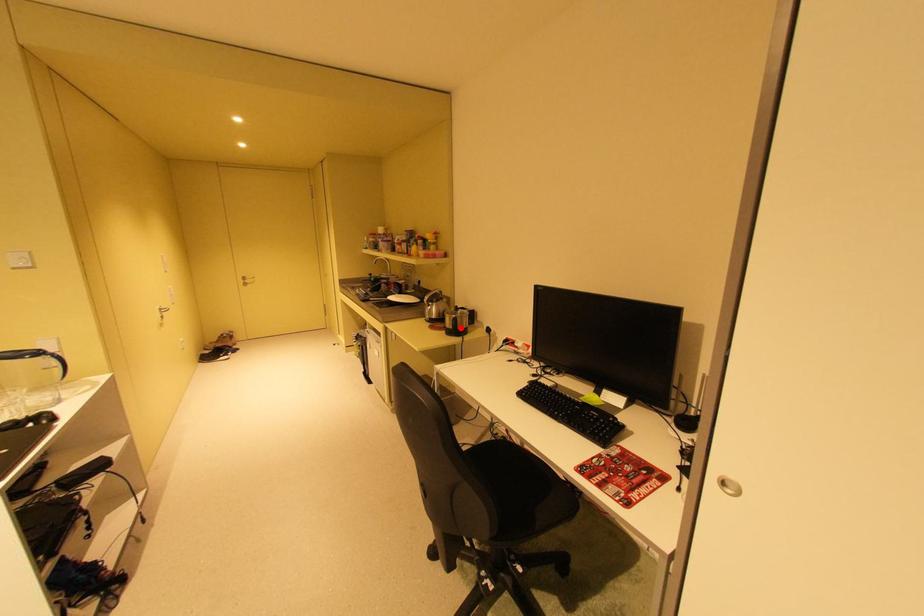
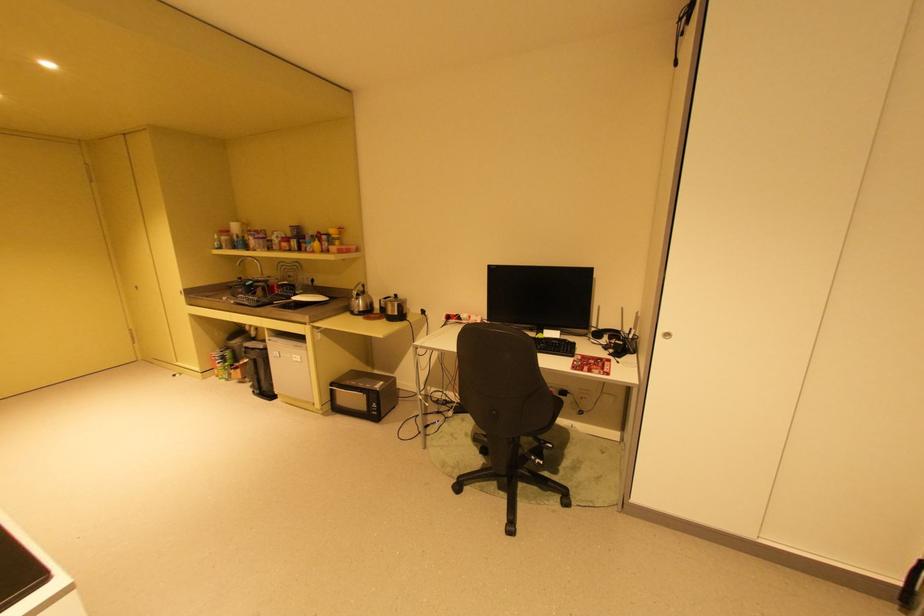
Where in the second image is the point corresponding to the highlighted location from the first image?

(404, 314)